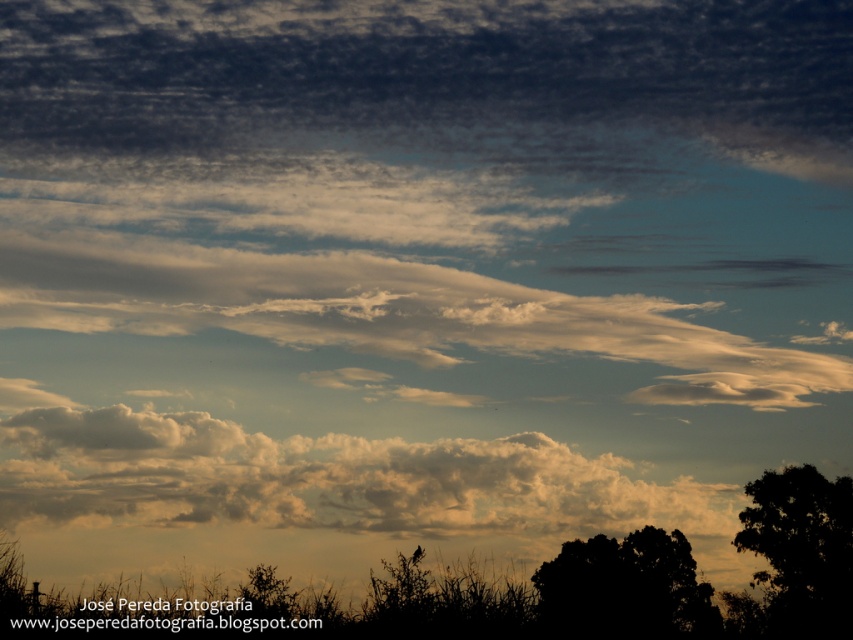
You are an astronomer observing the sky and notice the cloudy white at lower center and the black matte tree at lower right. Which object is positioned higher in the sky relative to the other?

The cloudy white at lower center is located above the black matte tree at lower right, meaning it is positioned higher in the sky.

You are an astronomer observing the sky and want to take a photo of the white fluffy cloud at center without the black matte tree at lower right blocking the view. Is the tree currently in front of or behind the cloud?

The black matte tree at lower right is behind the white fluffy cloud at center, so it is not blocking the view. You can take the photo without the tree obstructing the cloud.

You are an astronomer observing the sky and notice the cloudy white at lower center. Based on its position, can you determine if it is closer to the horizon or the top of the sky?

The cloudy white at lower center is located at point 0.383 on the vertical axis, which is closer to the horizon than the top of the sky.